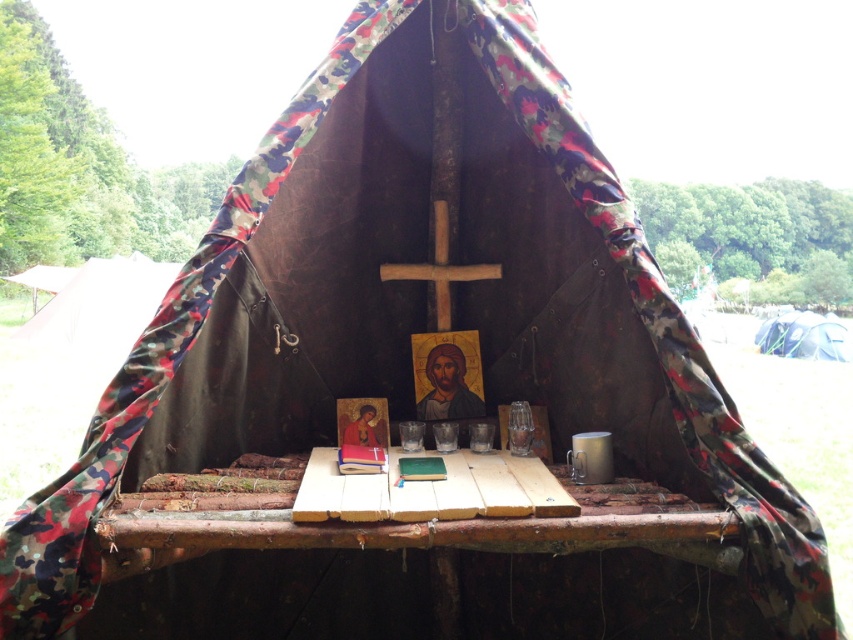
Is wooden picnic table at center wider than camo fabric tent at left?

Incorrect, wooden picnic table at center's width does not surpass camo fabric tent at left's.

This screenshot has height=640, width=853. I want to click on wooden picnic table at center, so click(x=416, y=557).

Who is more forward, [703,566] or [91,276]?

Positioned in front is point [703,566].

The width and height of the screenshot is (853, 640). In order to click on wooden picnic table at center in this screenshot , I will do `click(416, 557)`.

Which is behind, point (76, 333) or point (805, 310)?

The point (805, 310) is behind.

Between camo fabric tent at left and white canvas tent at right, which one appears on the left side from the viewer's perspective?

camo fabric tent at left

Image resolution: width=853 pixels, height=640 pixels. What do you see at coordinates (102, 305) in the screenshot?
I see `camo fabric tent at left` at bounding box center [102, 305].

This screenshot has width=853, height=640. I want to click on camo fabric tent at left, so click(x=102, y=305).

Does wooden picnic table at center have a larger size compared to white canvas tent at right?

Actually, wooden picnic table at center might be smaller than white canvas tent at right.

Looking at this image, can you confirm if wooden picnic table at center is positioned to the left of white canvas tent at right?

Correct, you'll find wooden picnic table at center to the left of white canvas tent at right.

Between point (676, 602) and point (769, 342), which one is positioned behind?

The point (769, 342) is more distant.

The width and height of the screenshot is (853, 640). I want to click on wooden picnic table at center, so click(416, 557).